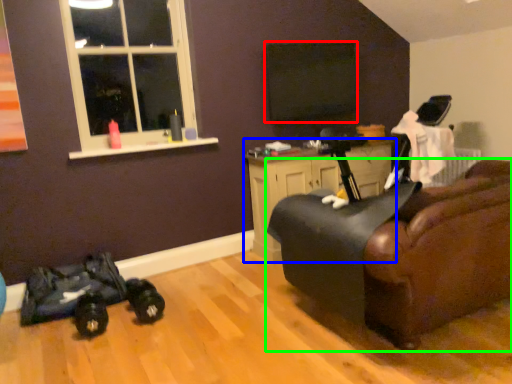
Question: Which is nearer to the window screen (highlighted by a red box)? cabinetry (highlighted by a blue box) or chair (highlighted by a green box).

Choices:
 (A) cabinetry
 (B) chair

Answer: (A)